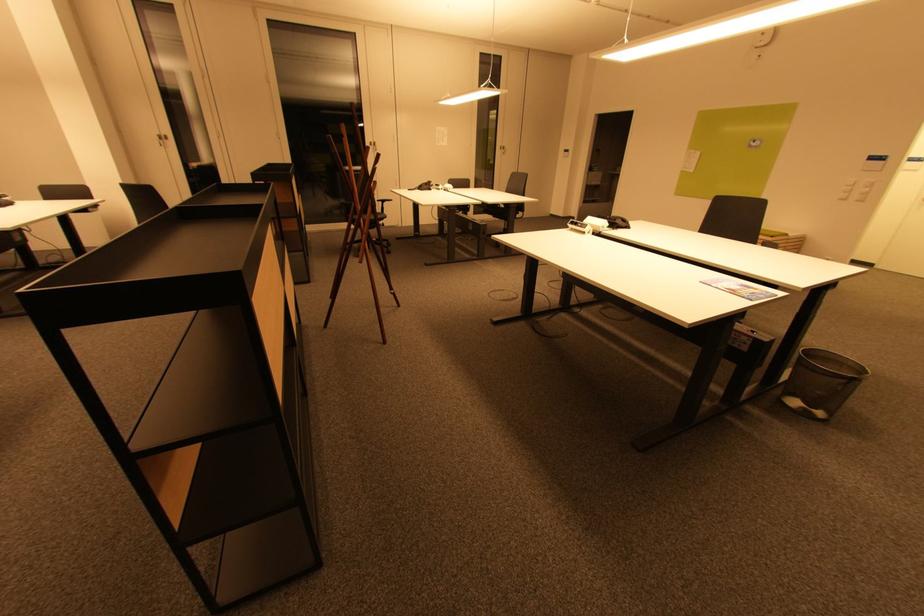
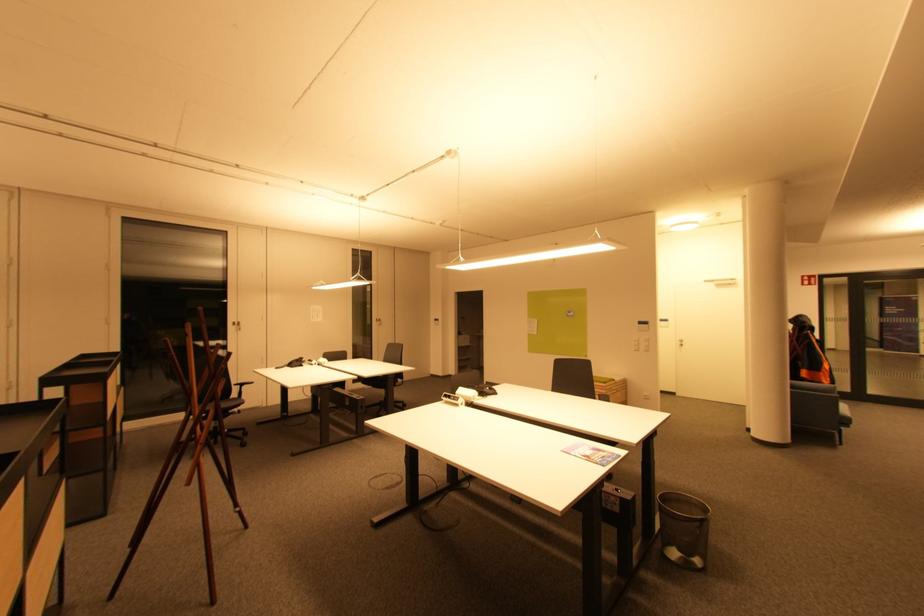
How did the camera likely rotate?

The camera rotated toward right-up.